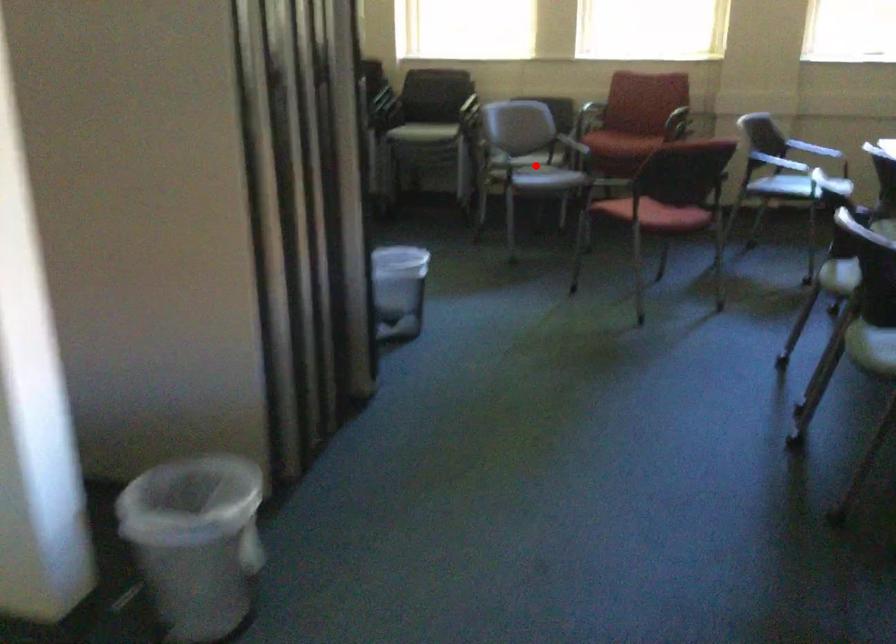
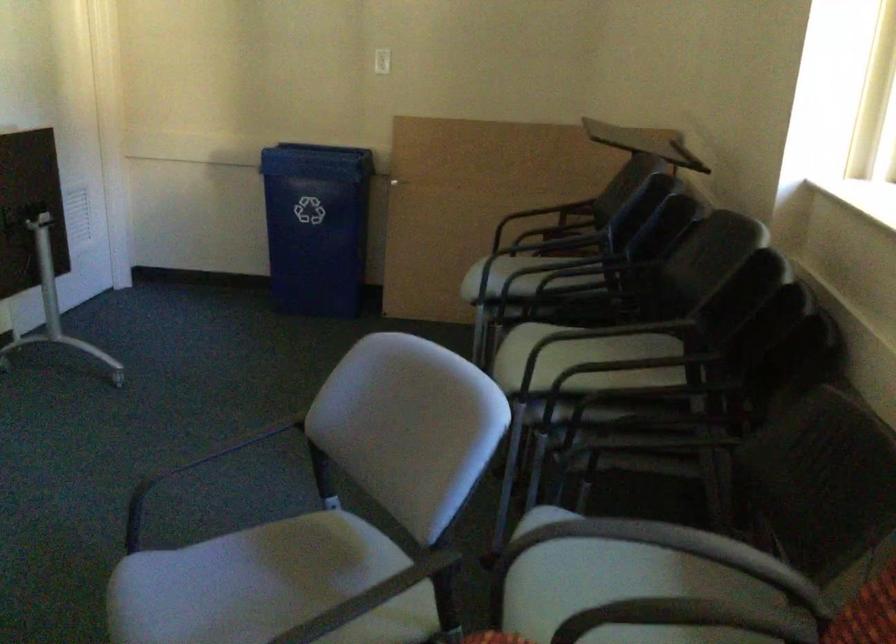
Question: I am providing you with two images of the same scene from different viewpoints. A red point is shown in image1. For the corresponding object point in image2, is it positioned nearer or farther from the camera?

Choices:
 (A) Nearer
 (B) Farther

Answer: (A)